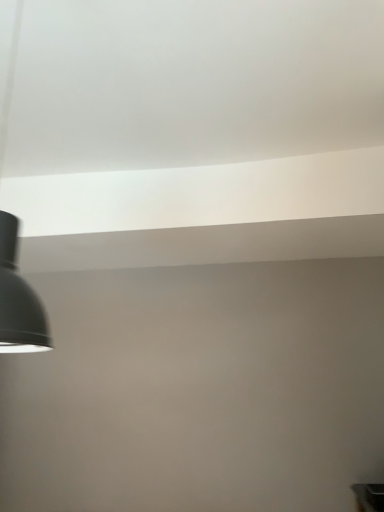
The image size is (384, 512). Identify the location of matte black lamp at left. (18, 298).

Measure the distance between matte black lamp at left and camera.

1.10 meters.

The height and width of the screenshot is (512, 384). Describe the element at coordinates (18, 298) in the screenshot. I see `matte black lamp at left` at that location.

Locate an element on the screen. The image size is (384, 512). matte black lamp at left is located at coordinates (18, 298).